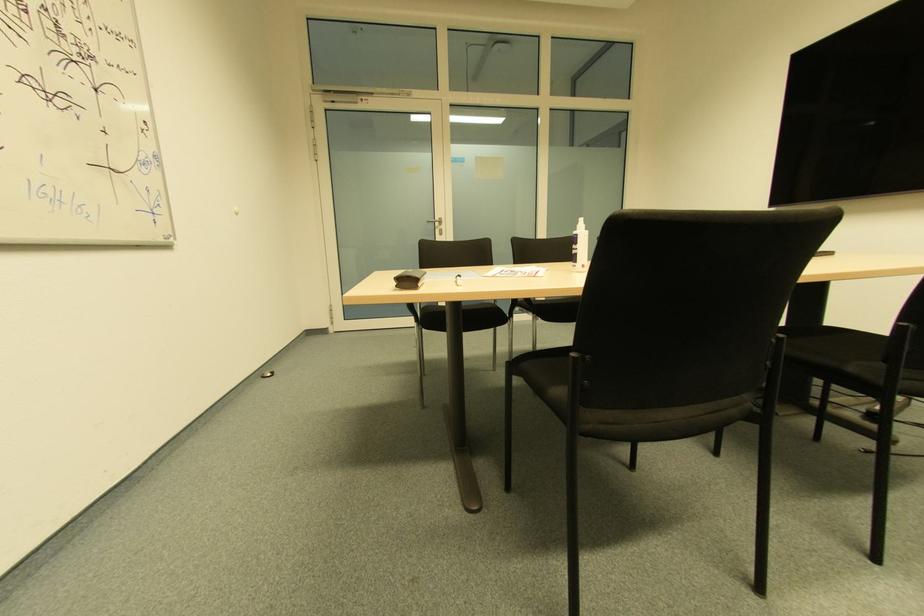
What do you see at coordinates (582, 224) in the screenshot? I see `the white dispenser pump` at bounding box center [582, 224].